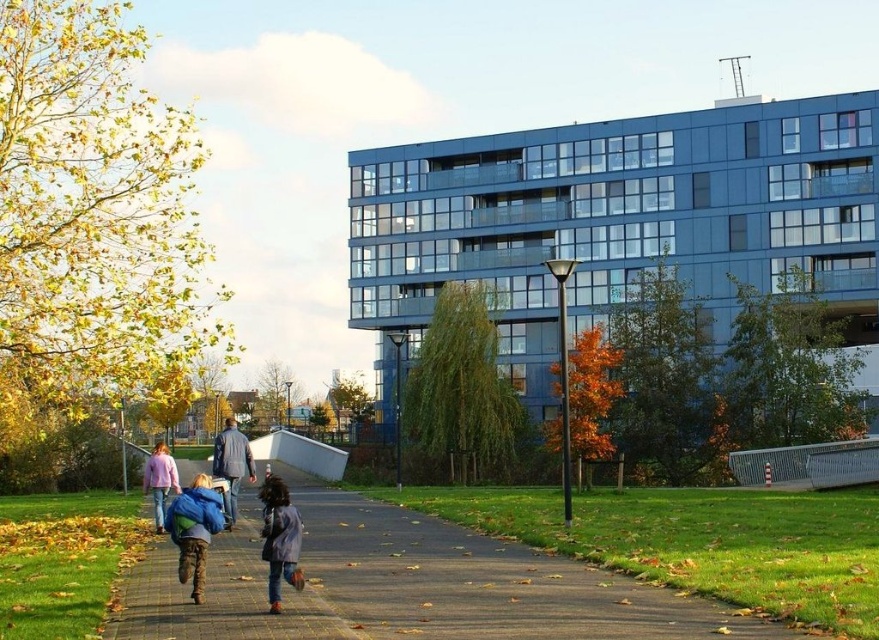
Is smooth asphalt path at center to the right of denim jacket at center from the viewer's perspective?

Indeed, smooth asphalt path at center is positioned on the right side of denim jacket at center.

Is smooth asphalt path at center smaller than denim jacket at center?

No.

Image resolution: width=879 pixels, height=640 pixels. What do you see at coordinates (409, 586) in the screenshot?
I see `smooth asphalt path at center` at bounding box center [409, 586].

The image size is (879, 640). What are the coordinates of `smooth asphalt path at center` in the screenshot? It's located at (409, 586).

Is denim jacket at center above pink fabric jacket at center?

Indeed, denim jacket at center is positioned over pink fabric jacket at center.

Between point (216, 458) and point (156, 504), which one is positioned in front?

Point (216, 458) is in front.

Between point (244, 460) and point (149, 484), which one is positioned behind?

The point (244, 460) is more distant.

Locate an element on the screen. This screenshot has width=879, height=640. denim jacket at center is located at coordinates point(231,465).

Which is more to the left, blue denim jacket at center or pink fabric jacket at center?

pink fabric jacket at center is more to the left.

Can you confirm if blue denim jacket at center is taller than pink fabric jacket at center?

No, blue denim jacket at center is not taller than pink fabric jacket at center.

Does point (273, 508) lie behind point (150, 464)?

No, (273, 508) is closer to viewer.

The height and width of the screenshot is (640, 879). I want to click on blue denim jacket at center, so click(x=280, y=538).